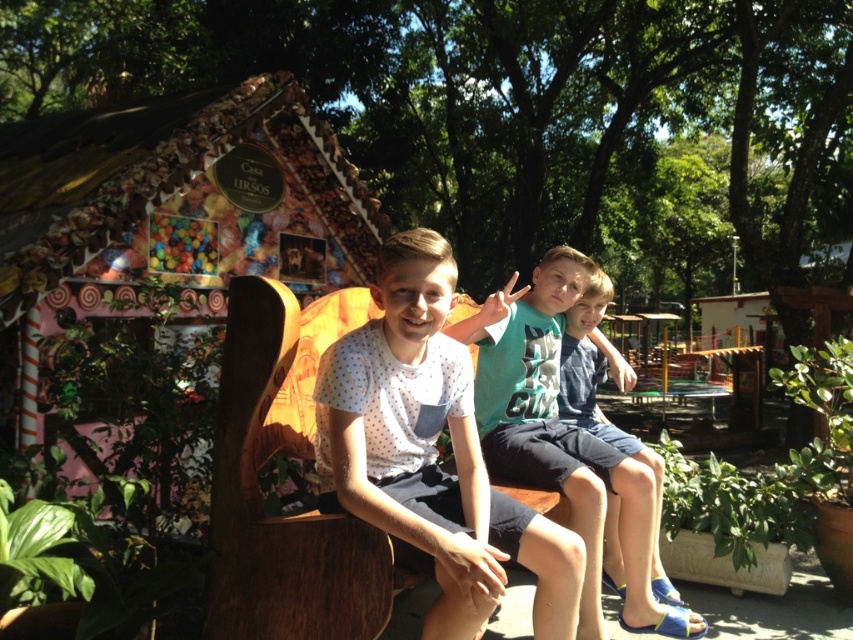
Does white dotted shirt at center have a larger size compared to blue denim shorts at center?

No, white dotted shirt at center is not bigger than blue denim shorts at center.

Between point (393, 513) and point (589, 291), which one is positioned behind?

Point (589, 291)

The width and height of the screenshot is (853, 640). I want to click on white dotted shirt at center, so click(430, 451).